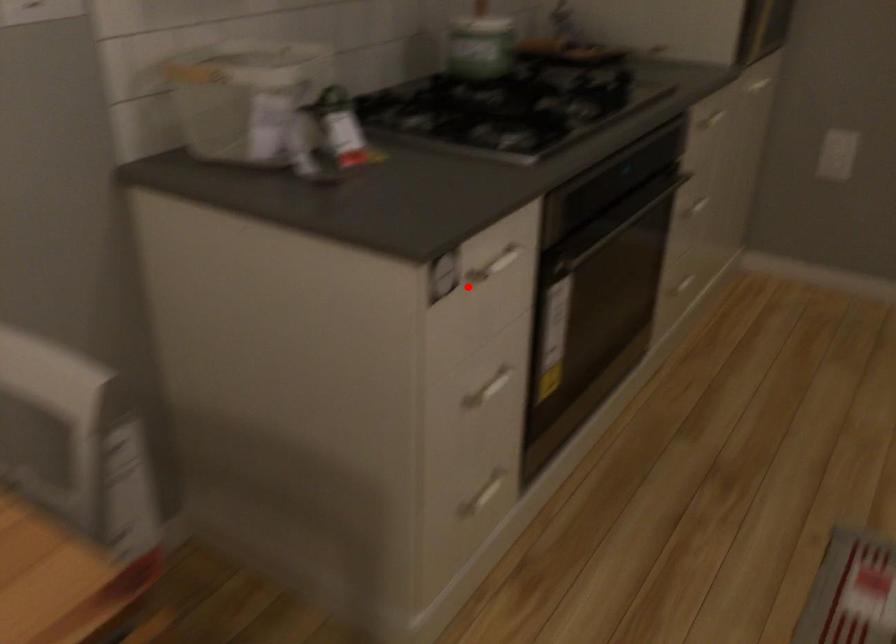
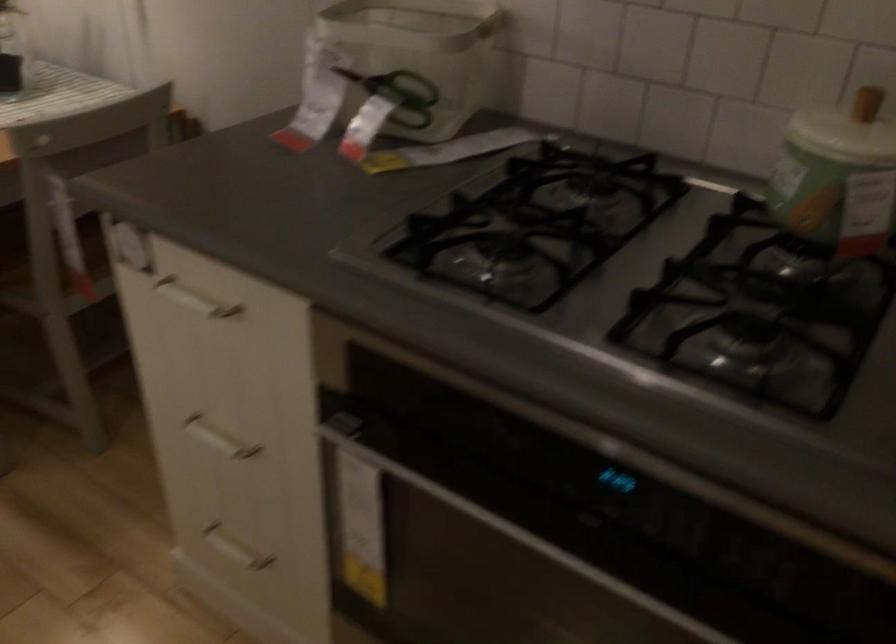
Where in the second image is the point corresponding to the highlighted location from the first image?

(194, 299)